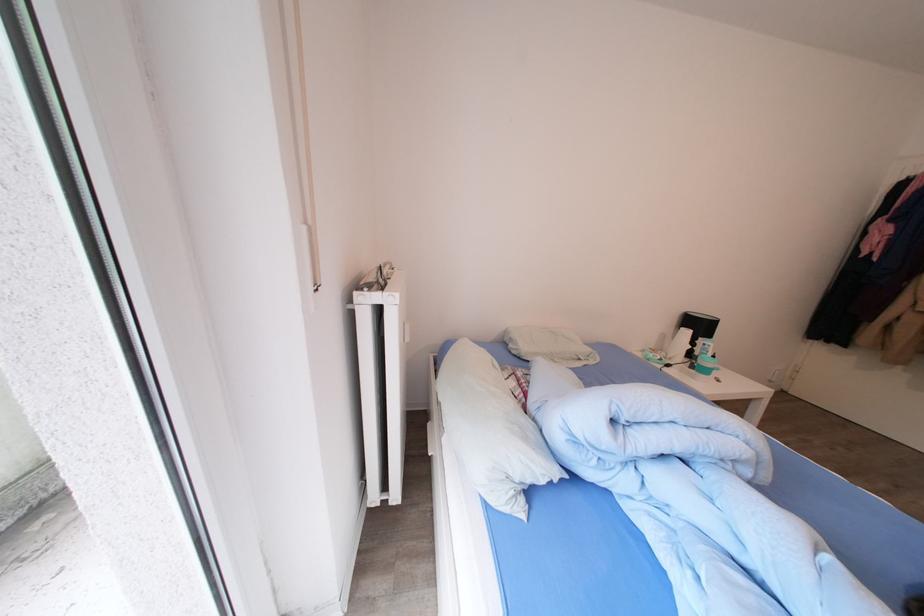
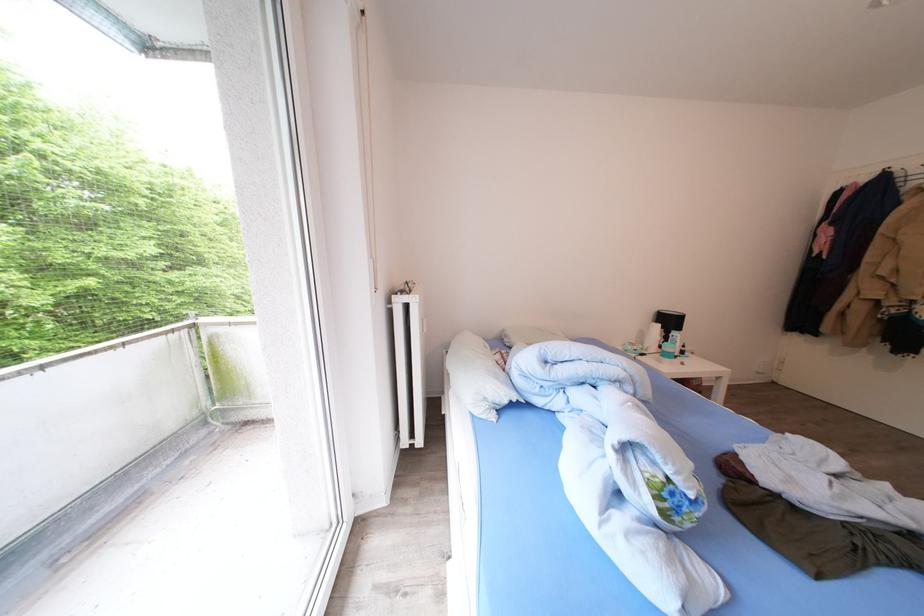
In the second image, find the point that corresponds to point 708,331 in the first image.

(677, 326)